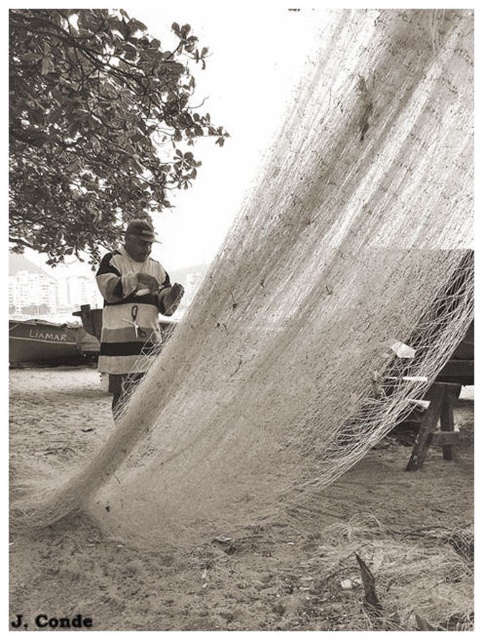
Question: Is striped fabric fisherman at center bigger than brushed metal boat at left?

Choices:
 (A) yes
 (B) no

Answer: (B)

Question: Which point is farther to the camera?

Choices:
 (A) coord(126,330)
 (B) coord(76,310)

Answer: (B)

Question: Can you confirm if striped fabric fisherman at center is bigger than brushed metal boat at left?

Choices:
 (A) yes
 (B) no

Answer: (B)

Question: Does striped fabric fisherman at center appear on the left side of brushed metal boat at left?

Choices:
 (A) no
 (B) yes

Answer: (A)